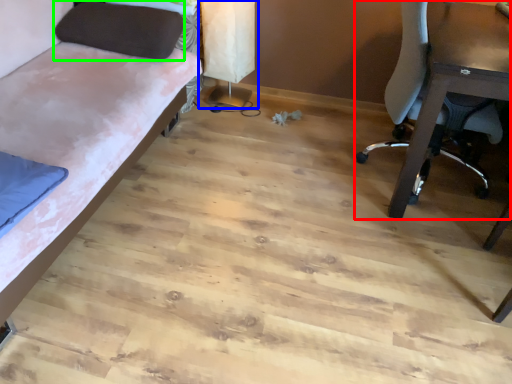
Question: Considering the real-world distances, which object is farthest from chair (highlighted by a red box)? table lamp (highlighted by a blue box) or pillow (highlighted by a green box)?

Choices:
 (A) table lamp
 (B) pillow

Answer: (B)